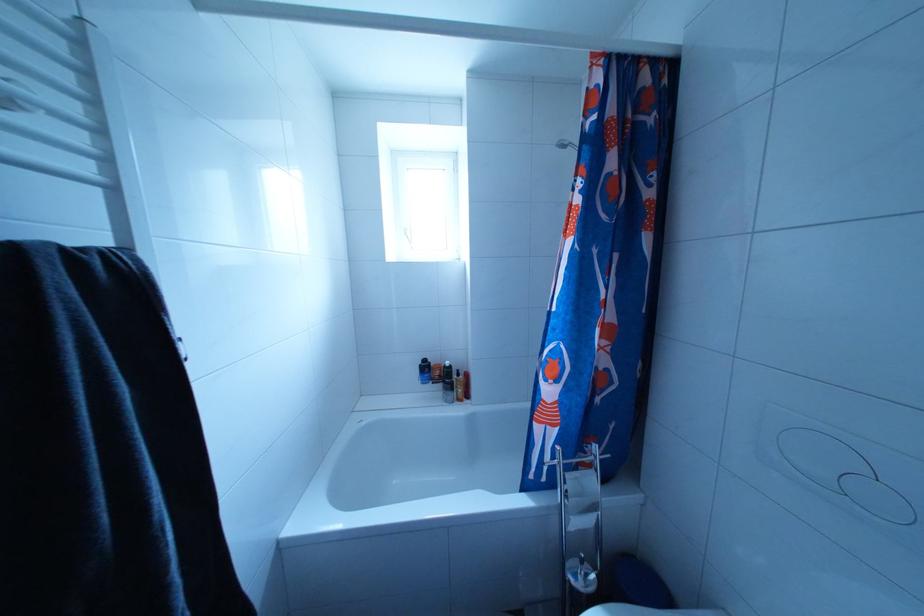
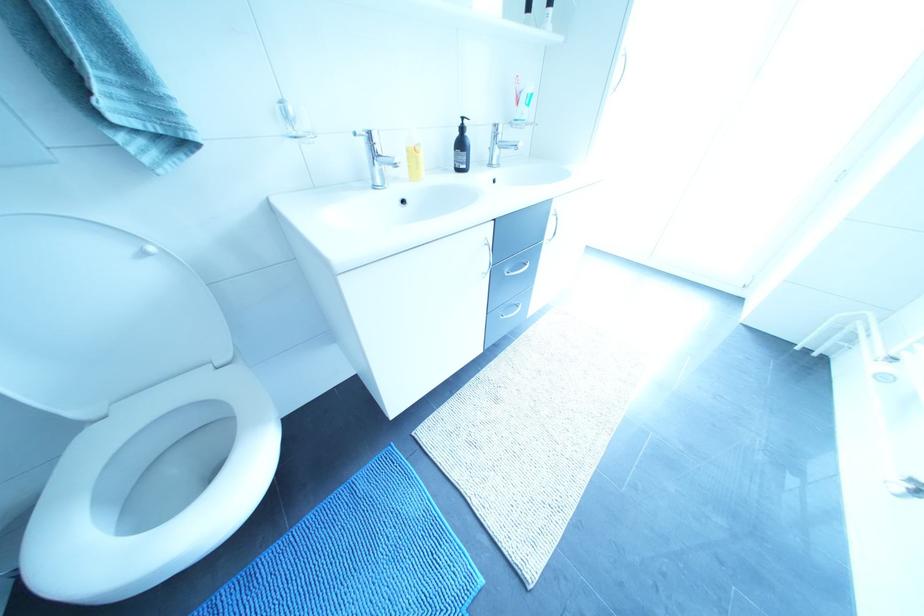
Question: I am providing you with two images of the same scene from different viewpoints. Please identify which objects are invisible in image2.

Choices:
 (A) yellow soap bottle
 (B) orange tape roll
 (C) clear toothbrush cup
 (D) red shampoo bottle

Answer: (D)